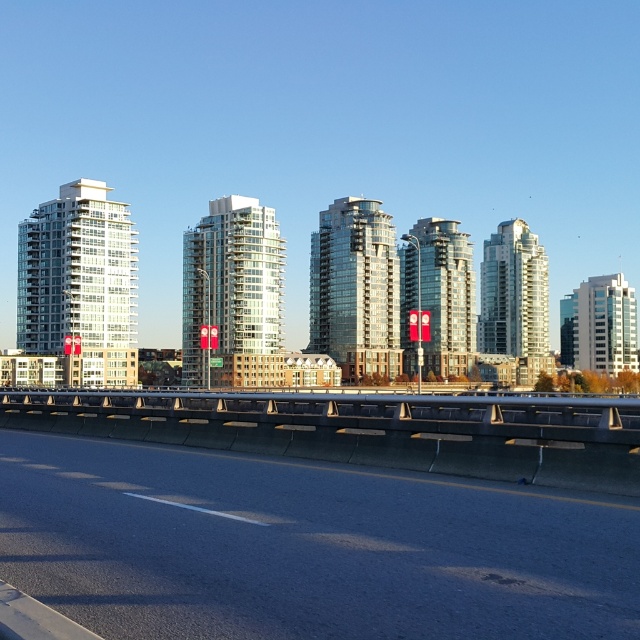
Question: Is black asphalt highway at lower center to the left of white glass building at left from the viewer's perspective?

Choices:
 (A) yes
 (B) no

Answer: (B)

Question: Can you confirm if glossy glass building at center is wider than glassy reflective building at center?

Choices:
 (A) yes
 (B) no

Answer: (B)

Question: Which point is farther from the camera taking this photo?

Choices:
 (A) (461, 276)
 (B) (506, 289)
 (C) (145, 497)
 (D) (180, 342)

Answer: (D)

Question: Is glossy glass building at center bigger than glassy reflective building at center?

Choices:
 (A) yes
 (B) no

Answer: (B)

Question: Which is farther from the glassy reflective building at center?

Choices:
 (A) glassy white building at center
 (B) black asphalt highway at lower center

Answer: (B)

Question: Which point is closer to the camera?

Choices:
 (A) (376, 221)
 (B) (16, 465)

Answer: (B)